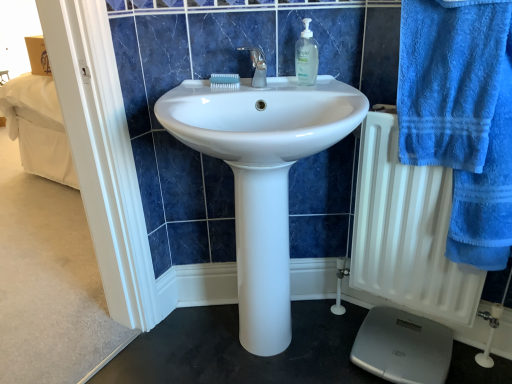
The height and width of the screenshot is (384, 512). In order to click on white matte radiator at right in this screenshot , I will do `click(407, 232)`.

What do you see at coordinates (403, 347) in the screenshot? I see `gray plastic scale at lower right` at bounding box center [403, 347].

What are the coordinates of `gray plastic scale at lower right` in the screenshot? It's located at (403, 347).

In order to face blue terry cloth towel at right, should I rotate leftwards or rightwards?

Turn right approximately 30.706 degrees to face it.

Where is `white matte radiator at right`? The image size is (512, 384). white matte radiator at right is located at coordinates (407, 232).

Consider the image. Does white glossy sink at center come in front of clear plastic soap dispenser at upper center?

Yes, the depth of white glossy sink at center is less than that of clear plastic soap dispenser at upper center.

Is white glossy sink at center positioned beyond the bounds of clear plastic soap dispenser at upper center?

white glossy sink at center lies outside clear plastic soap dispenser at upper center's area.

Does white glossy sink at center turn towards clear plastic soap dispenser at upper center?

No.

Can you confirm if white glossy sink at center is thinner than clear plastic soap dispenser at upper center?

In fact, white glossy sink at center might be wider than clear plastic soap dispenser at upper center.

Can you confirm if white matte radiator at right is wider than clear plastic soap dispenser at upper center?

Yes.

Is white matte radiator at right next to clear plastic soap dispenser at upper center?

No.

Is white matte radiator at right completely or partially outside of clear plastic soap dispenser at upper center?

Yes, white matte radiator at right is located beyond the bounds of clear plastic soap dispenser at upper center.

I want to click on sink below the clear plastic soap dispenser at upper center (from a real-world perspective), so click(262, 174).

From the image's perspective, which object appears higher, clear plastic soap dispenser at upper center or white glossy sink at center?

clear plastic soap dispenser at upper center is shown above in the image.

Is clear plastic soap dispenser at upper center inside the boundaries of white glossy sink at center, or outside?

clear plastic soap dispenser at upper center exists entirely within white glossy sink at center.

Consider the image. Does clear plastic soap dispenser at upper center turn towards white glossy sink at center?

Yes, clear plastic soap dispenser at upper center is aimed at white glossy sink at center.

From a real-world perspective, is gray plastic scale at lower right positioned above or below clear plastic soap dispenser at upper center?

From a real-world perspective, gray plastic scale at lower right is physically below clear plastic soap dispenser at upper center.

Is the position of gray plastic scale at lower right less distant than that of clear plastic soap dispenser at upper center?

No, gray plastic scale at lower right is behind clear plastic soap dispenser at upper center.

Is gray plastic scale at lower right situated inside clear plastic soap dispenser at upper center or outside?

gray plastic scale at lower right exists outside the volume of clear plastic soap dispenser at upper center.

Is gray plastic scale at lower right looking in the opposite direction of white glossy sink at center?

No, gray plastic scale at lower right's orientation is not away from white glossy sink at center.

Considering the points (421, 351) and (284, 129), which point is behind, point (421, 351) or point (284, 129)?

The point (421, 351) is farther from the camera.

Can you tell me how much gray plastic scale at lower right and white glossy sink at center differ in facing direction?

33.1 degrees.

From the image's perspective, is gray plastic scale at lower right over white glossy sink at center?

Actually, gray plastic scale at lower right appears below white glossy sink at center in the image.

Locate an element on the screen. The height and width of the screenshot is (384, 512). soap dispenser on the left of blue terry cloth towel at right is located at coordinates (306, 56).

From the image's perspective, is blue terry cloth towel at right under clear plastic soap dispenser at upper center?

Yes.

Between blue terry cloth towel at right and clear plastic soap dispenser at upper center, which one has more height?

With more height is blue terry cloth towel at right.

Does blue terry cloth towel at right have a smaller size compared to gray plastic scale at lower right?

Incorrect, blue terry cloth towel at right is not smaller in size than gray plastic scale at lower right.

How many degrees apart are the facing directions of blue terry cloth towel at right and gray plastic scale at lower right?

They differ by 1.37 degrees in their facing directions.

Is the surface of blue terry cloth towel at right in direct contact with gray plastic scale at lower right?

blue terry cloth towel at right and gray plastic scale at lower right are not in contact.

Image resolution: width=512 pixels, height=384 pixels. What are the coordinates of `soap dispenser on the right of white glossy sink at center` in the screenshot? It's located at (306, 56).

This screenshot has width=512, height=384. What are the coordinates of `soap dispenser behind the white matte radiator at right` in the screenshot? It's located at (306, 56).

From the picture: Considering their positions, is white matte radiator at right positioned further to blue terry cloth towel at right than white glossy sink at center?

Based on the image, white glossy sink at center appears to be further to blue terry cloth towel at right.

Considering their positions, is white glossy sink at center positioned further to gray plastic scale at lower right than white matte radiator at right?

white glossy sink at center is further to gray plastic scale at lower right.

Based on their spatial positions, is gray plastic scale at lower right or blue terry cloth towel at right closer to white matte radiator at right?

blue terry cloth towel at right.

Estimate the real-world distances between objects in this image. Which object is closer to white matte radiator at right, white glossy sink at center or blue terry cloth towel at right?

Based on the image, blue terry cloth towel at right appears to be nearer to white matte radiator at right.

Which object lies further to the anchor point gray plastic scale at lower right, blue terry cloth towel at right or white glossy sink at center?

blue terry cloth towel at right is further to gray plastic scale at lower right.

Looking at the image, which one is located further to white matte radiator at right, blue terry cloth towel at right or clear plastic soap dispenser at upper center?

Among the two, clear plastic soap dispenser at upper center is located further to white matte radiator at right.

Looking at the image, which one is located closer to white matte radiator at right, clear plastic soap dispenser at upper center or white glossy sink at center?

Among the two, white glossy sink at center is located nearer to white matte radiator at right.

From the image, which object appears to be farther from clear plastic soap dispenser at upper center, blue terry cloth towel at right or white glossy sink at center?

Among the two, blue terry cloth towel at right is located further to clear plastic soap dispenser at upper center.

Find the location of a particular element. The width and height of the screenshot is (512, 384). scale located between white glossy sink at center and white matte radiator at right in the left-right direction is located at coordinates (403, 347).

Find the location of a particular element. The image size is (512, 384). radiator between white glossy sink at center and blue terry cloth towel at right in the horizontal direction is located at coordinates [x=407, y=232].

This screenshot has height=384, width=512. Identify the location of radiator between clear plastic soap dispenser at upper center and gray plastic scale at lower right vertically. (407, 232).

The width and height of the screenshot is (512, 384). In order to click on radiator between clear plastic soap dispenser at upper center and white glossy sink at center in the up-down direction in this screenshot , I will do `click(407, 232)`.